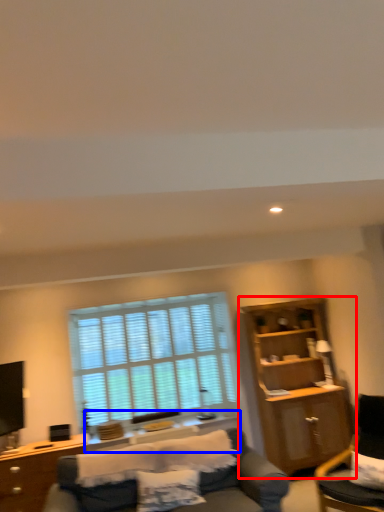
Question: Which of the following is the farthest to the observer, cabinetry (highlighted by a red box) or side table (highlighted by a blue box)?

Choices:
 (A) cabinetry
 (B) side table

Answer: (B)